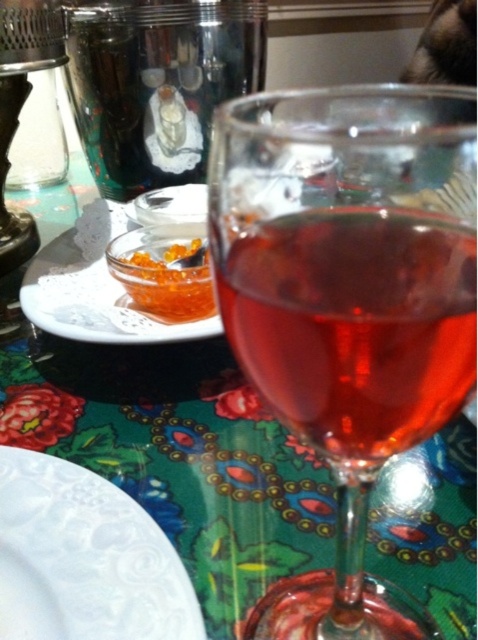
Question: Which object is the farthest from the orange caviar at center?

Choices:
 (A) white lace plate at upper left
 (B) translucent glass wine at center
 (C) shiny metallic cup at upper left

Answer: (B)

Question: Does shiny metallic cup at upper left have a larger size compared to white lace plate at upper left?

Choices:
 (A) no
 (B) yes

Answer: (B)

Question: Which point is farther to the camera?

Choices:
 (A) (268, 336)
 (B) (434, 278)

Answer: (A)

Question: From the image, what is the correct spatial relationship of translucent glass wine at center in relation to white embossed plate at lower left?

Choices:
 (A) left
 (B) right

Answer: (B)

Question: Can you confirm if shiny metallic cup at upper left is smaller than white embossed plate at lower left?

Choices:
 (A) no
 (B) yes

Answer: (A)

Question: Which point appears closest to the camera in this image?

Choices:
 (A) (466, 140)
 (B) (184, 276)

Answer: (A)